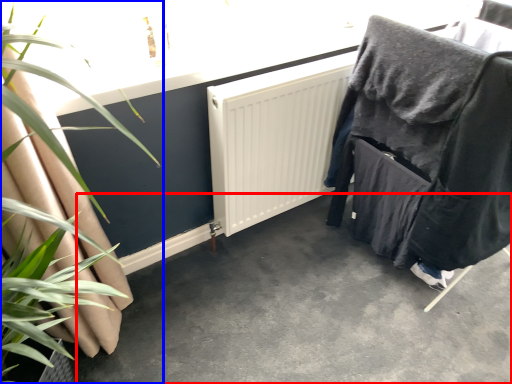
Question: Among these objects, which one is nearest to the camera, concrete (highlighted by a red box) or houseplant (highlighted by a blue box)?

Choices:
 (A) concrete
 (B) houseplant

Answer: (B)